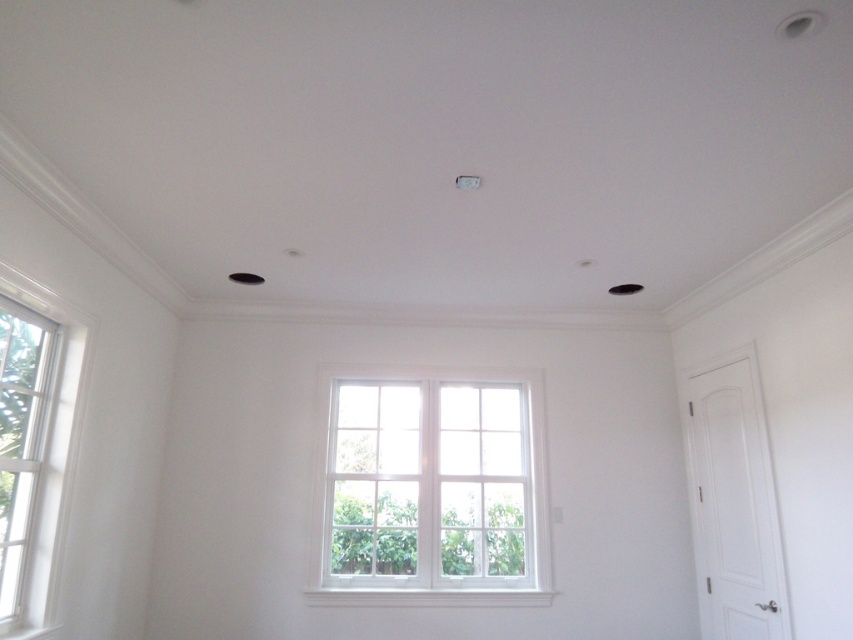
Question: Which point is farther to the camera?

Choices:
 (A) white painted wood bay window at center
 (B) white wood window at left

Answer: (A)

Question: Is white painted wood bay window at center wider than white wood window at left?

Choices:
 (A) yes
 (B) no

Answer: (A)

Question: In this image, where is white painted wood bay window at center located relative to white wood window at left?

Choices:
 (A) left
 (B) right

Answer: (B)

Question: Is white painted wood bay window at center bigger than white wood window at left?

Choices:
 (A) no
 (B) yes

Answer: (B)

Question: Which point is farther to the camera?

Choices:
 (A) (10, 620)
 (B) (511, 552)

Answer: (B)